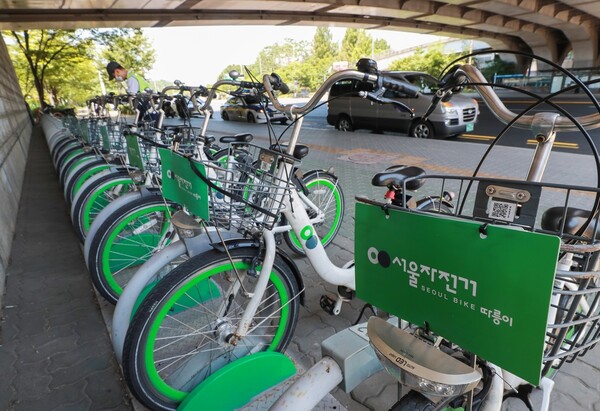
Locate an element on the screen. The image size is (600, 411). handles is located at coordinates (495, 111), (280, 101), (210, 99), (159, 102), (129, 102), (113, 102), (100, 102).